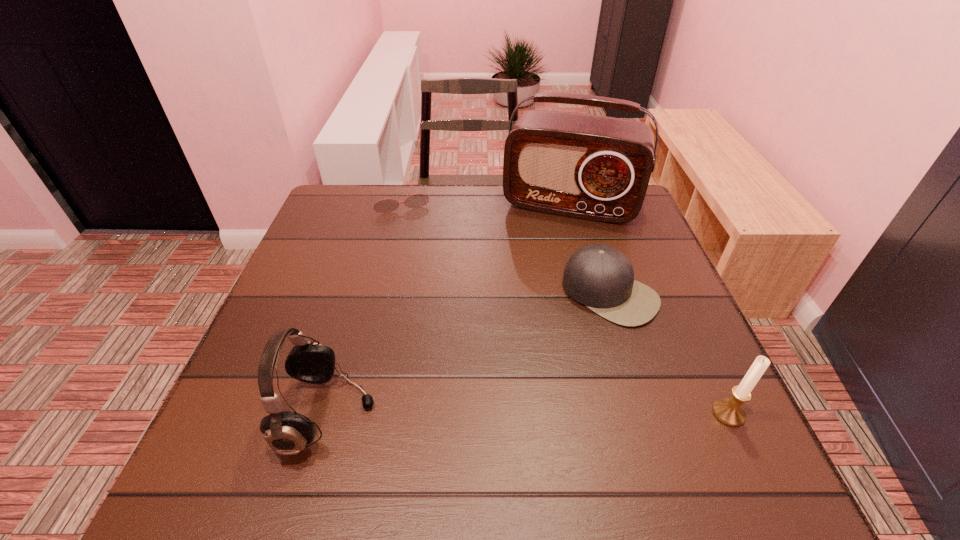
Image resolution: width=960 pixels, height=540 pixels. I want to click on the second tallest object, so click(x=287, y=433).

Locate an element on the screen. The width and height of the screenshot is (960, 540). the third shortest object is located at coordinates (730, 412).

Where is `the second shortest object`? The height and width of the screenshot is (540, 960). the second shortest object is located at coordinates (600, 277).

Locate an element on the screen. the third nearest object is located at coordinates [x=600, y=277].

You are a GUI agent. You are given a task and a screenshot of the screen. Output one action in this format:
    pyautogui.click(x=<x>, y=<y>)
    Task: Click on the tallest object
    This screenshot has width=960, height=540.
    Given the screenshot: What is the action you would take?
    pyautogui.click(x=592, y=167)

At what (x,y) coordinates should I click in order to perform the action: click on sunglasses. Please return your answer as a coordinate pair (x, y). The height and width of the screenshot is (540, 960). Looking at the image, I should click on (417, 200).

Identify the location of free region located 0.330m with the microphone on the side of the second tallest object. (560, 414).

This screenshot has height=540, width=960. I want to click on free space located on the back of the candle holder, so click(x=670, y=287).

Where is `free space located on the brim of the cap`? The height and width of the screenshot is (540, 960). free space located on the brim of the cap is located at coordinates (527, 387).

I want to click on free space located 0.270m on the brim of the cap, so click(x=511, y=404).